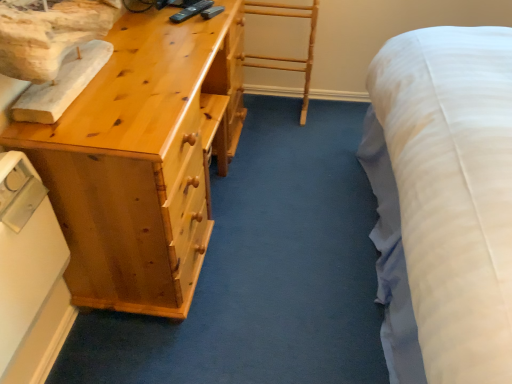
Question: Is white plastic switch at lower left spatially inside light wood chest of drawers at left, or outside of it?

Choices:
 (A) inside
 (B) outside

Answer: (B)

Question: Is white plastic switch at lower left to the left or to the right of light wood chest of drawers at left in the image?

Choices:
 (A) right
 (B) left

Answer: (B)

Question: From their relative heights in the image, would you say white plastic switch at lower left is taller or shorter than light wood chest of drawers at left?

Choices:
 (A) tall
 (B) short

Answer: (B)

Question: In terms of size, does light wood chest of drawers at left appear bigger or smaller than white plastic switch at lower left?

Choices:
 (A) small
 (B) big

Answer: (B)

Question: From the image's perspective, is light wood chest of drawers at left located above or below white plastic switch at lower left?

Choices:
 (A) below
 (B) above

Answer: (B)

Question: Visually, is light wood chest of drawers at left positioned to the left or to the right of white plastic switch at lower left?

Choices:
 (A) left
 (B) right

Answer: (B)

Question: In terms of height, does light wood chest of drawers at left look taller or shorter compared to white plastic switch at lower left?

Choices:
 (A) short
 (B) tall

Answer: (B)